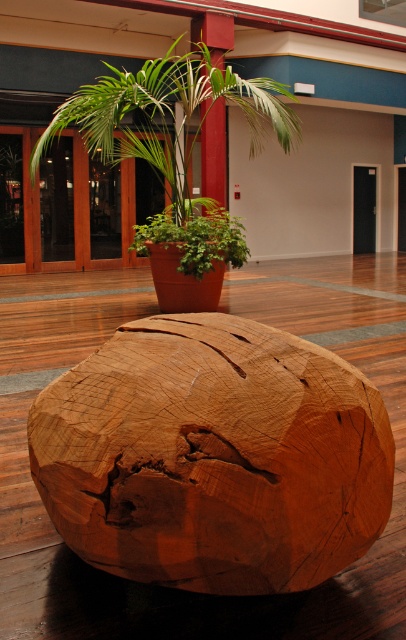
Question: Can you confirm if wooden sphere at center is thinner than green leafy plant at upper center?

Choices:
 (A) no
 (B) yes

Answer: (A)

Question: Which of the following is the closest to the observer?

Choices:
 (A) wooden sphere at center
 (B) green leafy plant at center
 (C) green leafy plant at upper center

Answer: (A)

Question: Which point is closer to the camera?

Choices:
 (A) (138, 96)
 (B) (190, 529)

Answer: (B)

Question: Can you confirm if wooden sphere at center is wider than green leafy plant at upper center?

Choices:
 (A) no
 (B) yes

Answer: (B)

Question: Can you confirm if green leafy plant at upper center is smaller than green leafy plant at center?

Choices:
 (A) yes
 (B) no

Answer: (A)

Question: Among these objects, which one is nearest to the camera?

Choices:
 (A) green leafy plant at center
 (B) wooden sphere at center

Answer: (B)